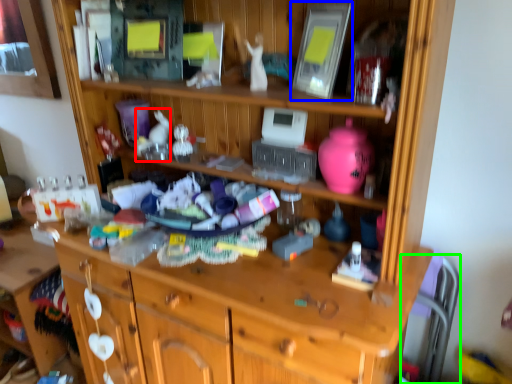
Question: Based on their relative distances, which object is nearer to toy (highlighted by a red box)? Choose from picture frame (highlighted by a blue box) and chair (highlighted by a green box).

Choices:
 (A) picture frame
 (B) chair

Answer: (A)